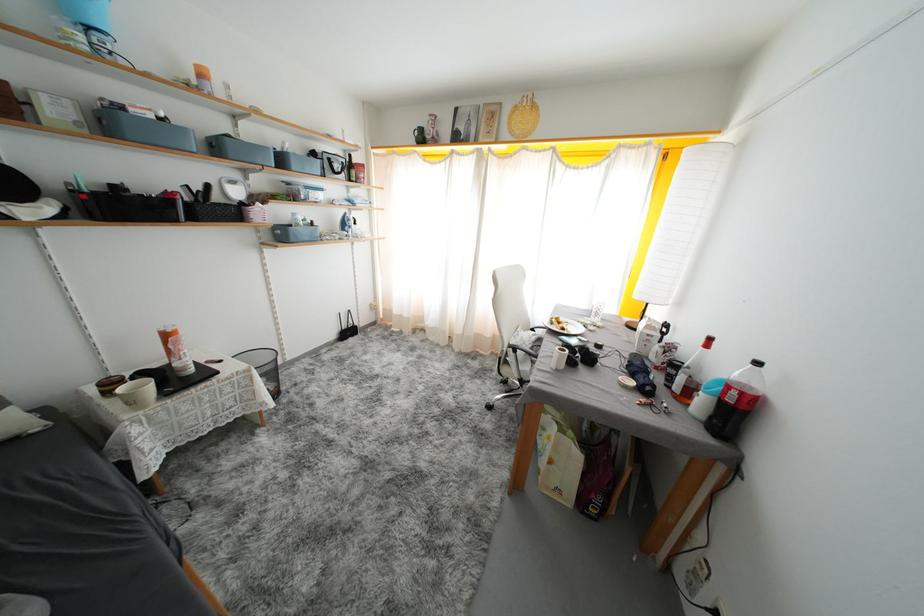
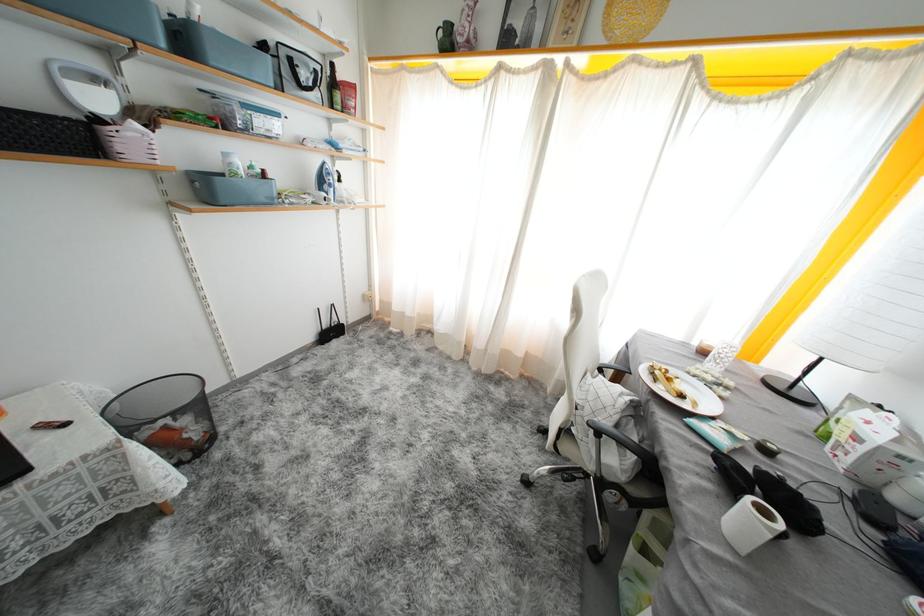
Find the pixel in the second image that matches the point at 422,137 in the first image.

(446, 37)